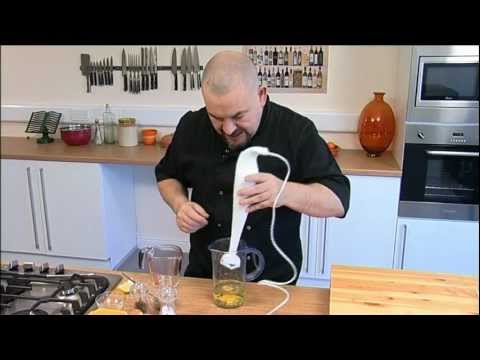
Identify the location of stove top. The image size is (480, 360). (66, 286).